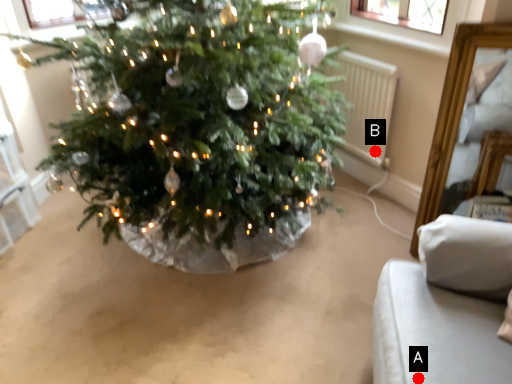
Question: Two points are circled on the image, labeled by A and B beside each circle. Which point is farther to the camera?

Choices:
 (A) A is further
 (B) B is further

Answer: (B)